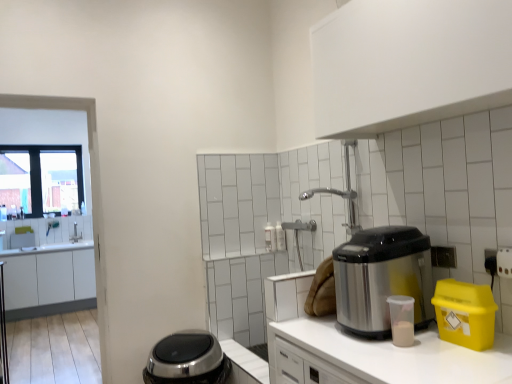
You are a GUI agent. You are given a task and a screenshot of the screen. Output one action in this format:
    pyautogui.click(x=<x>, y=<y>)
    Task: Click on the white matte cabinet at left, which is the first cabinetry from left to right
    This screenshot has width=512, height=384.
    Given the screenshot: What is the action you would take?
    pyautogui.click(x=49, y=276)

Describe the element at coordinates (380, 357) in the screenshot. I see `white matte countertop at center` at that location.

What do you see at coordinates (465, 313) in the screenshot? I see `yellow plastic bin at right, the second appliance positioned from the left` at bounding box center [465, 313].

Find the location of a particular element. This screenshot has height=384, width=512. clear glass window at upper left is located at coordinates (41, 178).

What is the approximate width of clear glass window at upper left?

The width of clear glass window at upper left is 16.26 centimeters.

How much space does satin silver appliance at lower center, arranged as the first appliance when viewed from the back, occupy horizontally?

satin silver appliance at lower center, arranged as the first appliance when viewed from the back, is 17.24 inches in width.

Locate an element on the screen. This screenshot has width=512, height=384. white matte cabinet at left, arranged as the second cabinetry when viewed from the top is located at coordinates (49, 276).

Does point (54, 270) appear closer or farther from the camera than point (341, 261)?

Point (54, 270).

Locate an element on the screen. The width and height of the screenshot is (512, 384). cabinetry below the stainless steel appliance at right (from a real-world perspective) is located at coordinates (49, 276).

Who is smaller, white matte cabinet at left, which is the 1th cabinetry in back-to-front order, or stainless steel appliance at right?

With smaller size is stainless steel appliance at right.

Consider the image. From the image's perspective, which one is positioned lower, white matte cabinet at left, which is counted as the second cabinetry, starting from the right, or stainless steel appliance at right?

white matte cabinet at left, which is counted as the second cabinetry, starting from the right, is shown below in the image.

From the image's perspective, which is above, satin silver appliance at lower center, arranged as the first appliance when viewed from the back, or yellow plastic bin at right, the 2th appliance when ordered from back to front?

yellow plastic bin at right, the 2th appliance when ordered from back to front, from the image's perspective.

From a real-world perspective, is satin silver appliance at lower center, marked as the 1th appliance in a left-to-right arrangement, physically below yellow plastic bin at right, which appears as the first appliance when viewed from the top?

Yes.

Does satin silver appliance at lower center, the 2th appliance from the front, have a lesser width compared to yellow plastic bin at right, which appears as the first appliance when viewed from the top?

In fact, satin silver appliance at lower center, the 2th appliance from the front, might be wider than yellow plastic bin at right, which appears as the first appliance when viewed from the top.

Is satin silver appliance at lower center, the 2th appliance from the front, positioned in front of yellow plastic bin at right, placed as the first appliance when sorted from right to left?

No.

Which of these two, satin silver appliance at lower center, marked as the 2th appliance in a right-to-left arrangement, or white matte countertop at center, is thinner?

With smaller width is satin silver appliance at lower center, marked as the 2th appliance in a right-to-left arrangement.

Looking at this image, how many degrees apart are the facing directions of satin silver appliance at lower center, the 2th appliance from the front, and white matte countertop at center?

The facing directions of satin silver appliance at lower center, the 2th appliance from the front, and white matte countertop at center are 91.5 degrees apart.

Measure the distance from satin silver appliance at lower center, marked as the 2th appliance in a right-to-left arrangement, to white matte countertop at center.

satin silver appliance at lower center, marked as the 2th appliance in a right-to-left arrangement, is 27.62 inches away from white matte countertop at center.

Looking at this image, based on their sizes in the image, would you say satin silver appliance at lower center, arranged as the first appliance when viewed from the back, is bigger or smaller than white matte countertop at center?

Clearly, satin silver appliance at lower center, arranged as the first appliance when viewed from the back, is smaller in size than white matte countertop at center.

From the image's perspective, is clear glass window at upper left below white matte countertop at center?

No.

In the scene shown: Is clear glass window at upper left inside the boundaries of white matte countertop at center, or outside?

clear glass window at upper left is not enclosed by white matte countertop at center.

Is clear glass window at upper left turned away from white matte countertop at center?

No, clear glass window at upper left is not facing the opposite direction of white matte countertop at center.

Is the depth of clear glass window at upper left greater than that of white matte countertop at center?

Yes, clear glass window at upper left is behind white matte countertop at center.

Which is more to the right, clear glass window at upper left or stainless steel appliance at right?

From the viewer's perspective, stainless steel appliance at right appears more on the right side.

Is point (16, 203) more distant than point (390, 293)?

Yes.

Does clear glass window at upper left have a greater width compared to stainless steel appliance at right?

No, clear glass window at upper left is not wider than stainless steel appliance at right.

From the image's perspective, which is below, clear glass window at upper left or stainless steel appliance at right?

From the image's view, stainless steel appliance at right is below.

Where is `cabinetry that appears behind the white matte cabinet at upper center, placed as the second cabinetry when sorted from back to front`? cabinetry that appears behind the white matte cabinet at upper center, placed as the second cabinetry when sorted from back to front is located at coordinates (49, 276).

Is white matte cabinet at left, arranged as the second cabinetry when viewed from the top, facing towards white matte cabinet at upper center, placed as the second cabinetry when sorted from back to front?

Yes, white matte cabinet at left, arranged as the second cabinetry when viewed from the top, is aimed at white matte cabinet at upper center, placed as the second cabinetry when sorted from back to front.

From the image's perspective, is white matte cabinet at left, the first cabinetry ordered from the bottom, located above or below white matte cabinet at upper center, placed as the second cabinetry when sorted from back to front?

Clearly, from the image's perspective, white matte cabinet at left, the first cabinetry ordered from the bottom, is below white matte cabinet at upper center, placed as the second cabinetry when sorted from back to front.

Is white matte cabinet at left, the first cabinetry ordered from the bottom, not inside white matte cabinet at upper center, which appears as the 1th cabinetry when viewed from the right?

Yes, white matte cabinet at left, the first cabinetry ordered from the bottom, is not within white matte cabinet at upper center, which appears as the 1th cabinetry when viewed from the right.

From a real-world perspective, relative to white matte cabinet at upper center, positioned as the 2th cabinetry in bottom-to-top order, is yellow plastic bin at right, the second appliance when ordered from bottom to top, vertically above or below?

From a real-world perspective, yellow plastic bin at right, the second appliance when ordered from bottom to top, is physically below white matte cabinet at upper center, positioned as the 2th cabinetry in bottom-to-top order.

Is yellow plastic bin at right, the second appliance when ordered from bottom to top, directly adjacent to white matte cabinet at upper center, the 1th cabinetry from the front?

yellow plastic bin at right, the second appliance when ordered from bottom to top, is not next to white matte cabinet at upper center, the 1th cabinetry from the front, and they're not touching.

From the image's perspective, is yellow plastic bin at right, the second appliance when ordered from bottom to top, on white matte cabinet at upper center, positioned as the 2th cabinetry in bottom-to-top order?

No, from the image's perspective, yellow plastic bin at right, the second appliance when ordered from bottom to top, is not over white matte cabinet at upper center, positioned as the 2th cabinetry in bottom-to-top order.

How far apart are yellow plastic bin at right, the 2th appliance when ordered from back to front, and white matte cabinet at upper center, positioned as the 2th cabinetry in bottom-to-top order?

They are 30.61 inches apart.

What are the coordinates of `home appliance that appears on the right of white matte cabinet at left, which is the first cabinetry from left to right` in the screenshot? It's located at (382, 278).

Where is `appliance below the yellow plastic bin at right, positioned as the 1th appliance in front-to-back order (from a real-world perspective)`? This screenshot has width=512, height=384. appliance below the yellow plastic bin at right, positioned as the 1th appliance in front-to-back order (from a real-world perspective) is located at coordinates (187, 360).

Which object lies further to the anchor point white matte cabinet at upper center, the 1th cabinetry from the front, yellow plastic bin at right, the second appliance when ordered from bottom to top, or white matte cabinet at left, which is the 1th cabinetry in back-to-front order?

white matte cabinet at left, which is the 1th cabinetry in back-to-front order.

Estimate the real-world distances between objects in this image. Which object is further from satin silver appliance at lower center, marked as the 2th appliance in a right-to-left arrangement, white matte countertop at center or white matte cabinet at left, which is the 1th cabinetry in back-to-front order?

white matte cabinet at left, which is the 1th cabinetry in back-to-front order, is further to satin silver appliance at lower center, marked as the 2th appliance in a right-to-left arrangement.

Looking at the image, which one is located further to white matte cabinet at left, which is the first cabinetry from left to right, white matte countertop at center or white matte cabinet at upper center, the second cabinetry in the left-to-right sequence?

Based on the image, white matte cabinet at upper center, the second cabinetry in the left-to-right sequence, appears to be further to white matte cabinet at left, which is the first cabinetry from left to right.

Based on their spatial positions, is white matte countertop at center or clear glass window at upper left further from yellow plastic bin at right, the second appliance positioned from the left?

Among the two, clear glass window at upper left is located further to yellow plastic bin at right, the second appliance positioned from the left.

From the image, which object appears to be farther from stainless steel appliance at right, clear glass window at upper left or white matte cabinet at upper center, arranged as the first cabinetry when viewed from the top?

clear glass window at upper left.

Considering their positions, is white matte cabinet at left, which is counted as the second cabinetry, starting from the right, positioned further to clear glass window at upper left than yellow plastic bin at right, the second appliance when ordered from bottom to top?

Based on the image, yellow plastic bin at right, the second appliance when ordered from bottom to top, appears to be further to clear glass window at upper left.

Estimate the real-world distances between objects in this image. Which object is closer to yellow plastic bin at right, the 2th appliance when ordered from back to front, white matte countertop at center or satin silver appliance at lower center, the second appliance viewed from the top?

Among the two, white matte countertop at center is located nearer to yellow plastic bin at right, the 2th appliance when ordered from back to front.

When comparing their distances from satin silver appliance at lower center, marked as the 2th appliance in a right-to-left arrangement, does stainless steel appliance at right or white matte cabinet at left, which is counted as the second cabinetry, starting from the right, seem further?

white matte cabinet at left, which is counted as the second cabinetry, starting from the right.

Where is `home appliance positioned between white matte countertop at center and clear glass window at upper left from near to far`? The image size is (512, 384). home appliance positioned between white matte countertop at center and clear glass window at upper left from near to far is located at coordinates pos(382,278).

Find the location of a particular element. cabinetry between stainless steel appliance at right and clear glass window at upper left from front to back is located at coordinates (49, 276).

Image resolution: width=512 pixels, height=384 pixels. I want to click on home appliance between white matte cabinet at upper center, the second cabinetry in the left-to-right sequence, and yellow plastic bin at right, which appears as the first appliance when viewed from the top, in the vertical direction, so click(382, 278).

Where is `cabinetry between yellow plastic bin at right, placed as the first appliance when sorted from right to left, and clear glass window at upper left from front to back`? cabinetry between yellow plastic bin at right, placed as the first appliance when sorted from right to left, and clear glass window at upper left from front to back is located at coordinates (49, 276).